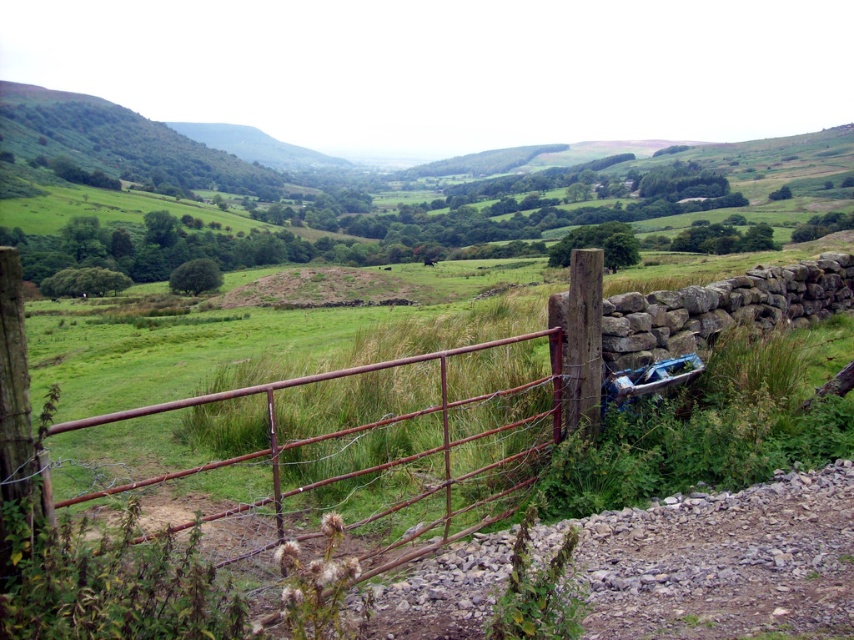
Question: Can you confirm if rusty metal gate at center is thinner than metallic blue car at right?

Choices:
 (A) no
 (B) yes

Answer: (A)

Question: Which point is farther to the camera?

Choices:
 (A) rusty metal gate at center
 (B) metallic blue car at right

Answer: (B)

Question: Can you confirm if rusty metal gate at center is positioned below metallic blue car at right?

Choices:
 (A) yes
 (B) no

Answer: (A)

Question: Is rusty metal gate at center above metallic blue car at right?

Choices:
 (A) no
 (B) yes

Answer: (A)